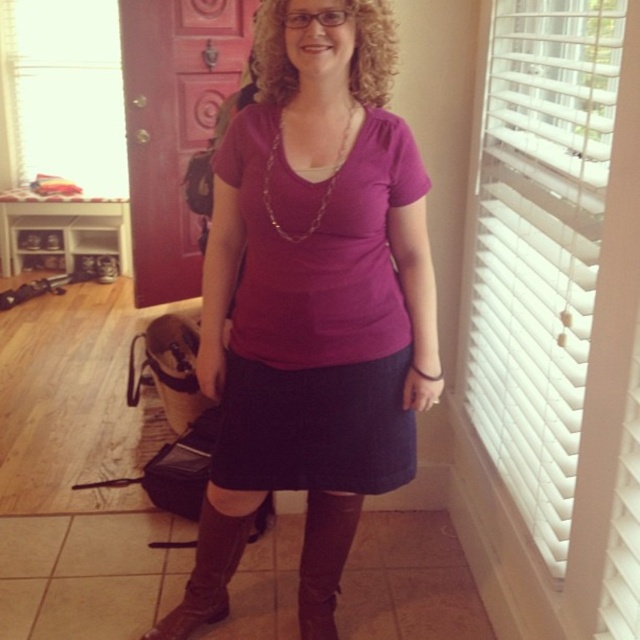
You are a delivery person who needs to place a small package on the closest object to you between the brown leather boot at lower center and the leather at center. Which object should you choose?

The brown leather boot at lower center is closer to the viewer than the leather at center, so you should place the package on the brown leather boot at lower center.

You are a delivery person who needs to place a small package on either the brown leather boot at lower center or the gold chain necklace at center. Which object can the package be placed on without it falling off?

The brown leather boot at lower center is larger in size than the gold chain necklace at center, so the small package can be placed on the brown leather boot at lower center without it falling off.

You are standing in the room and want to pick up the brown leather boot at lower center. Where should you look to find it?

The brown leather boot at lower center is located at the 2D coordinates point [209,566].